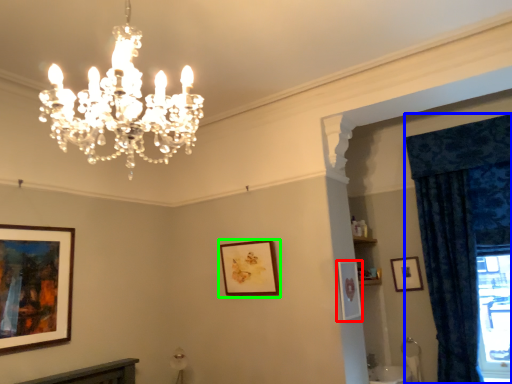
Question: Considering the real-world distances, which object is farthest from picture frame (highlighted by a red box)? curtain (highlighted by a blue box) or picture frame (highlighted by a green box)?

Choices:
 (A) curtain
 (B) picture frame

Answer: (A)